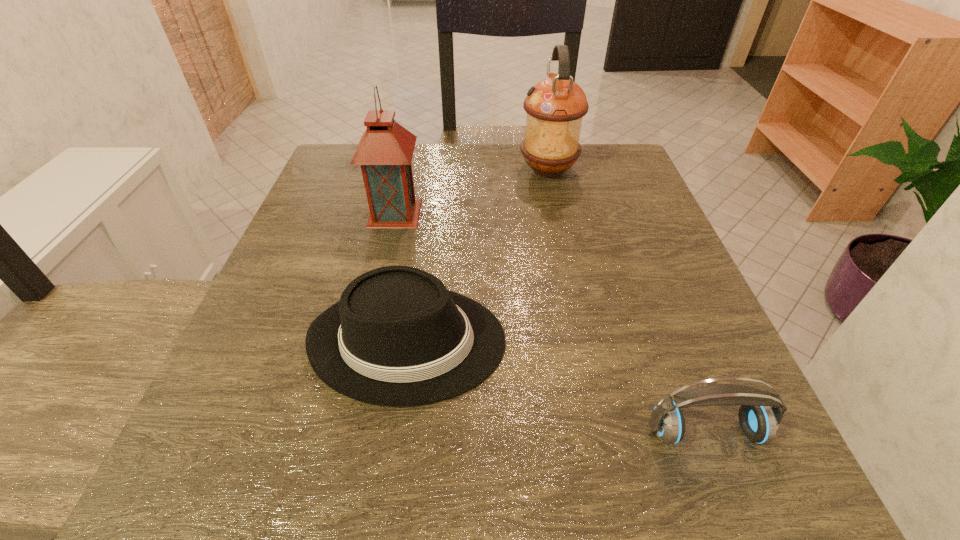
You are a GUI agent. You are given a task and a screenshot of the screen. Output one action in this format:
    pyautogui.click(x=<x>, y=<y>)
    Task: Click on the empty location between the lantern and the oil lamp
    Image resolution: width=960 pixels, height=540 pixels.
    Given the screenshot: What is the action you would take?
    pyautogui.click(x=471, y=192)

You are a GUI agent. You are given a task and a screenshot of the screen. Output one action in this format:
    pyautogui.click(x=<x>, y=<y>)
    Task: Click on the object that can be found as the second closest to the nearest object
    The width and height of the screenshot is (960, 540).
    Given the screenshot: What is the action you would take?
    pyautogui.click(x=385, y=151)

Identify the location of object that is the second closest to the second nearest object. The image size is (960, 540). (759, 422).